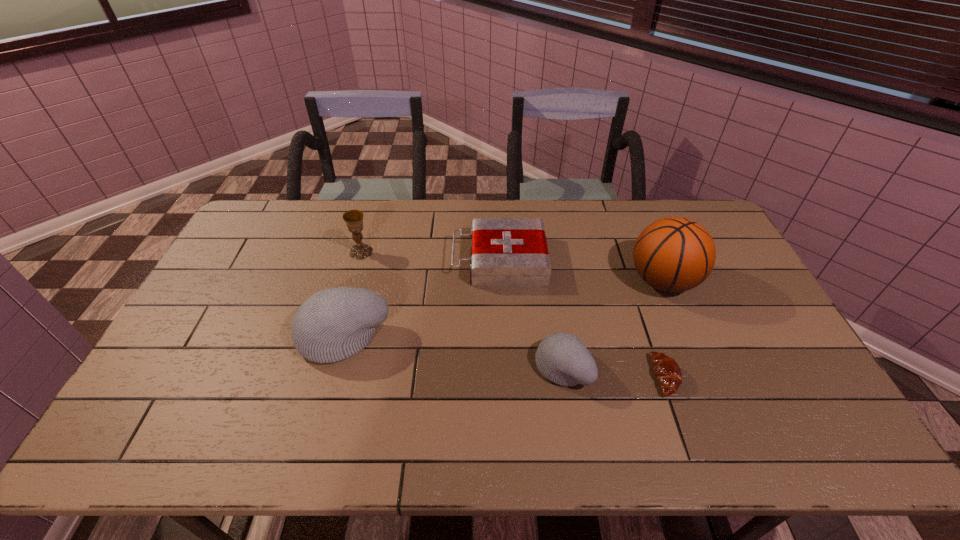
Image resolution: width=960 pixels, height=540 pixels. Find the location of `vacant region that satisfies the following two spatial constraints: 1. on the front side of the fifth tallest object; 2. on the back side of the shorter beanie`. vacant region that satisfies the following two spatial constraints: 1. on the front side of the fifth tallest object; 2. on the back side of the shorter beanie is located at coordinates (505, 367).

Locate an element on the screen. The height and width of the screenshot is (540, 960). free spot that satisfies the following two spatial constraints: 1. on the back side of the basketball; 2. on the left side of the fourth tallest object is located at coordinates (549, 280).

Where is `vacant region that satisfies the following two spatial constraints: 1. on the front side of the crescent roll; 2. on the right side of the taller beanie`? Image resolution: width=960 pixels, height=540 pixels. vacant region that satisfies the following two spatial constraints: 1. on the front side of the crescent roll; 2. on the right side of the taller beanie is located at coordinates (333, 376).

The image size is (960, 540). In order to click on free space in the image that satisfies the following two spatial constraints: 1. on the front side of the taller beanie; 2. on the left side of the crescent roll in this screenshot , I will do `click(333, 376)`.